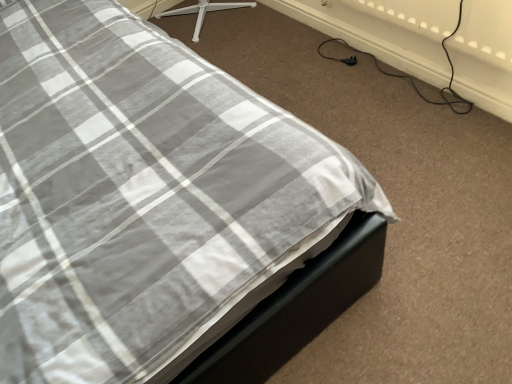
Find the location of `free spot below black rubber cable at lower right (from a real-world perspective)`. free spot below black rubber cable at lower right (from a real-world perspective) is located at coordinates (395, 65).